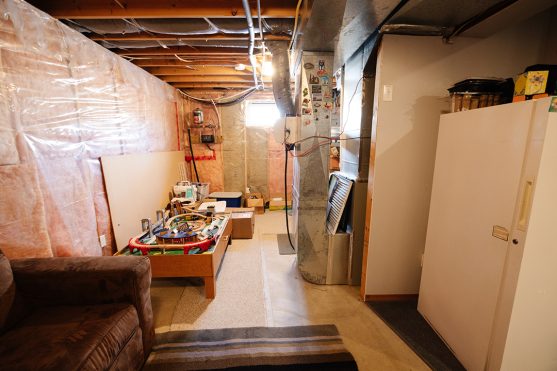
Find the location of a particular element. handle to open refridgerator is located at coordinates (526, 199).